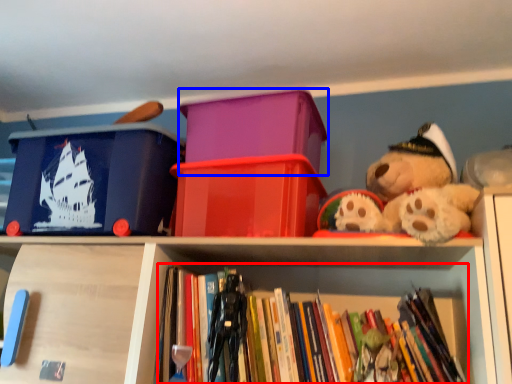
Question: Among these objects, which one is nearest to the camera, book (highlighted by a red box) or storage box (highlighted by a blue box)?

Choices:
 (A) book
 (B) storage box

Answer: (A)